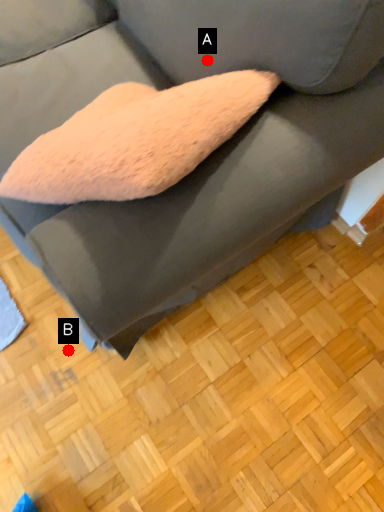
Question: Two points are circled on the image, labeled by A and B beside each circle. Which point is farther from the camera taking this photo?

Choices:
 (A) A is further
 (B) B is further

Answer: (B)